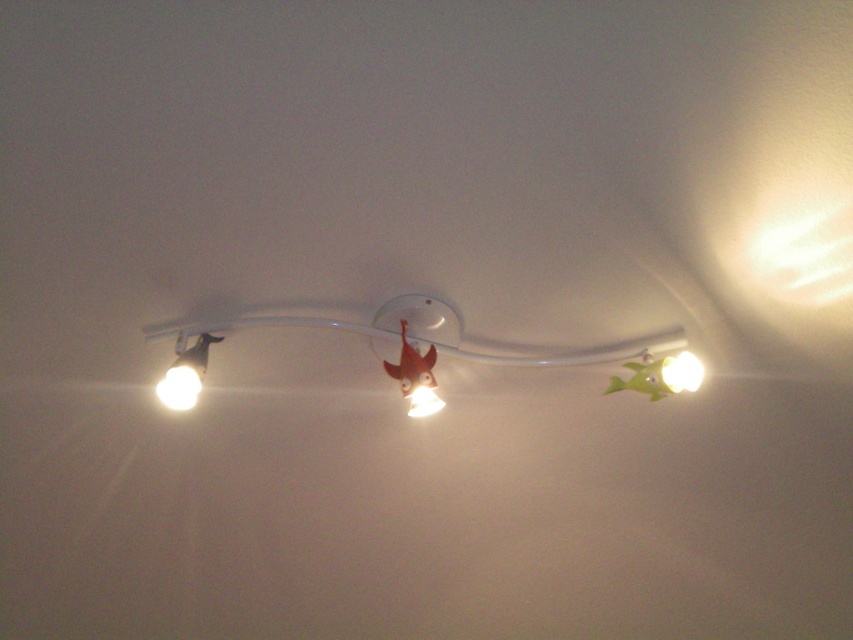
Question: Among these points, which one is farthest from the camera?

Choices:
 (A) (163, 378)
 (B) (196, 349)

Answer: (B)

Question: Is matte white spotlight at left below matte white spotlight at center?

Choices:
 (A) no
 (B) yes

Answer: (A)

Question: Is white glossy light bulb at left below matte white spotlight at center?

Choices:
 (A) yes
 (B) no

Answer: (B)

Question: Which point is farther to the camera?

Choices:
 (A) (178, 403)
 (B) (674, 378)
 (C) (181, 403)

Answer: (B)

Question: Is white glossy light bulb at left behind white glossy light at upper right?

Choices:
 (A) yes
 (B) no

Answer: (B)

Question: Which point appears farthest from the camera in this image?

Choices:
 (A) (689, 380)
 (B) (198, 376)

Answer: (A)